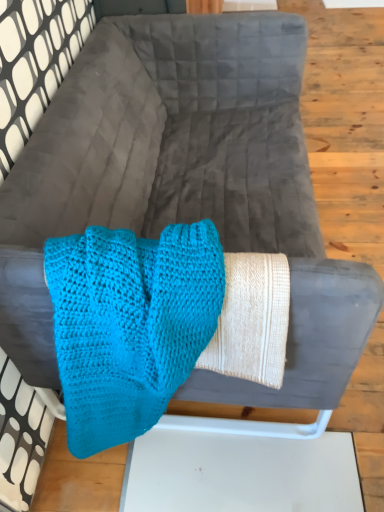
In order to click on turquoise knitted mittens at center in this screenshot , I will do `click(130, 324)`.

The image size is (384, 512). What do you see at coordinates (130, 324) in the screenshot?
I see `turquoise knitted mittens at center` at bounding box center [130, 324].

The width and height of the screenshot is (384, 512). Find the location of `turquoise knitted mittens at center`. turquoise knitted mittens at center is located at coordinates (130, 324).